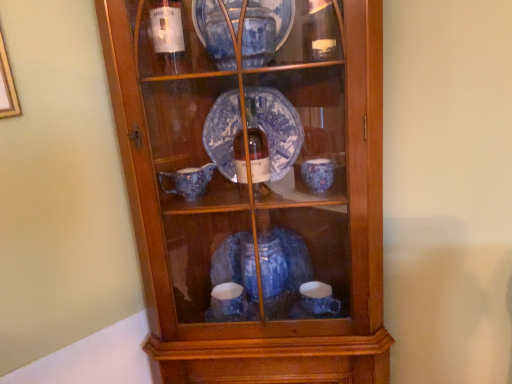
This screenshot has width=512, height=384. Describe the element at coordinates (253, 188) in the screenshot. I see `blue glazed ceramic plate at upper center` at that location.

Measure the distance between point (265,77) and camera.

They are 35.51 inches apart.

Identify the location of blue glazed ceramic plate at upper center. The width and height of the screenshot is (512, 384). (253, 188).

In order to face blue glazed ceramic plate at upper center, should I rotate leftwards or rightwards?

To align with it, rotate right about 0.759°.

This screenshot has width=512, height=384. In order to click on blue glazed ceramic plate at upper center in this screenshot , I will do `click(253, 188)`.